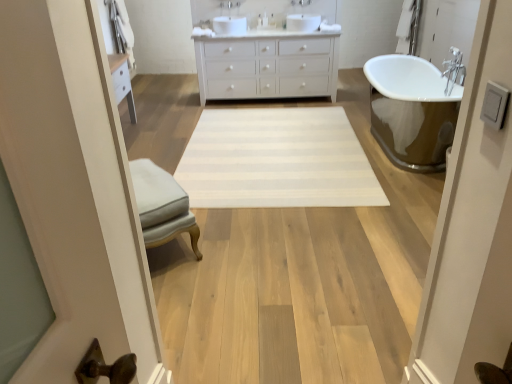
The height and width of the screenshot is (384, 512). I want to click on blank space situated above light gray fabric ottoman at center (from a real-world perspective), so click(x=148, y=175).